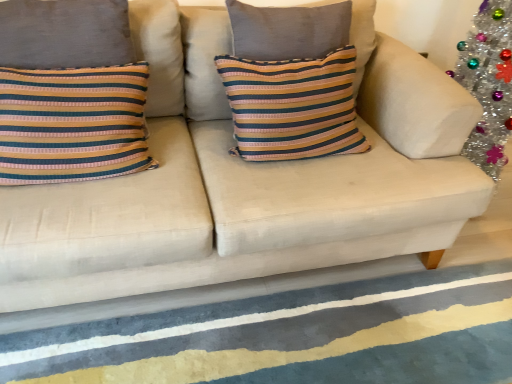
Question: From a real-world perspective, is textured blue rug at lower center above or below striped fabric pillow at center?

Choices:
 (A) below
 (B) above

Answer: (A)

Question: Relative to striped fabric pillow at center, is textured blue rug at lower center in front or behind?

Choices:
 (A) front
 (B) behind

Answer: (A)

Question: Would you say textured blue rug at lower center is inside or outside striped fabric pillow at center?

Choices:
 (A) inside
 (B) outside

Answer: (B)

Question: From a real-world perspective, is striped fabric pillow at center above or below textured blue rug at lower center?

Choices:
 (A) above
 (B) below

Answer: (A)

Question: In terms of height, does striped fabric pillow at center look taller or shorter compared to textured blue rug at lower center?

Choices:
 (A) tall
 (B) short

Answer: (A)

Question: From the image's perspective, is striped fabric pillow at center positioned above or below textured blue rug at lower center?

Choices:
 (A) below
 (B) above

Answer: (B)

Question: Considering their positions, is striped fabric pillow at center located in front of or behind textured blue rug at lower center?

Choices:
 (A) front
 (B) behind

Answer: (B)